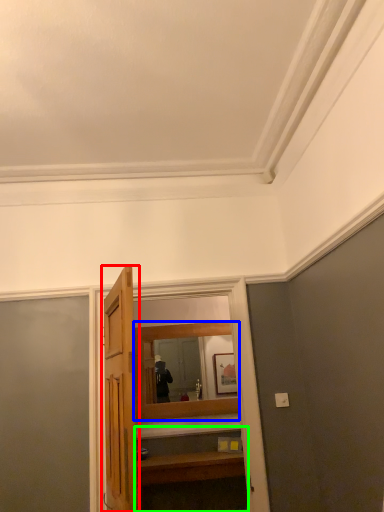
Question: Estimate the real-world distances between objects in this image. Which object is closer to door (highlighted by a red box), mirror (highlighted by a blue box) or vanity (highlighted by a green box)?

Choices:
 (A) mirror
 (B) vanity

Answer: (B)